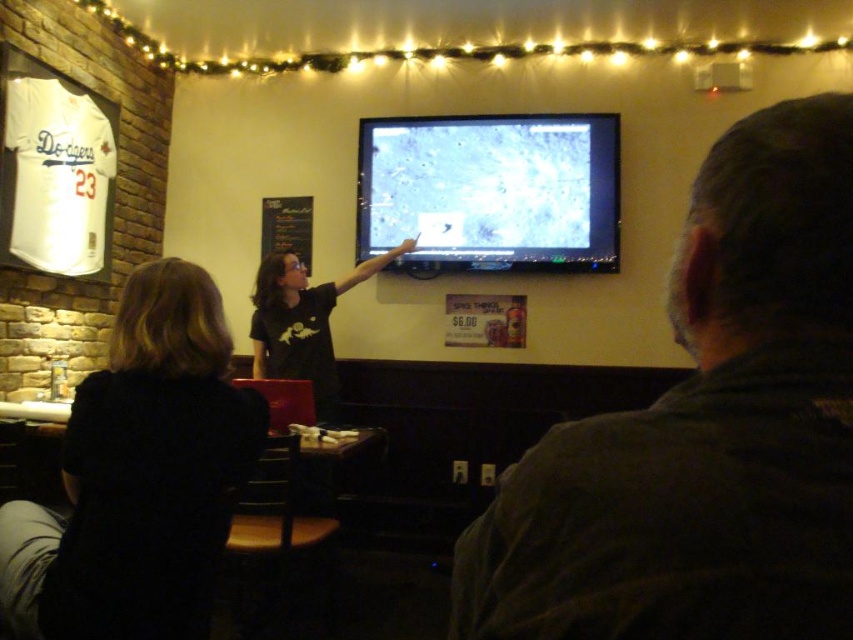
Question: Is dark brown leather jacket at upper right smaller than matte plastic screen at center?

Choices:
 (A) yes
 (B) no

Answer: (A)

Question: Which point is closer to the camera?

Choices:
 (A) black fabric shirt at lower left
 (B) dark brown leather jacket at upper right
 (C) matte plastic screen at center

Answer: (B)

Question: From the image, what is the correct spatial relationship of dark brown leather jacket at upper right in relation to matte plastic screen at center?

Choices:
 (A) below
 (B) above

Answer: (A)

Question: Which of the following is the closest to the observer?

Choices:
 (A) (242, 452)
 (B) (395, 170)
 (C) (555, 516)

Answer: (C)

Question: Which point appears closest to the camera in this image?

Choices:
 (A) (70, 417)
 (B) (697, 276)
 (C) (427, 184)

Answer: (B)

Question: Does dark brown leather jacket at upper right appear on the left side of black fabric shirt at lower left?

Choices:
 (A) no
 (B) yes

Answer: (A)